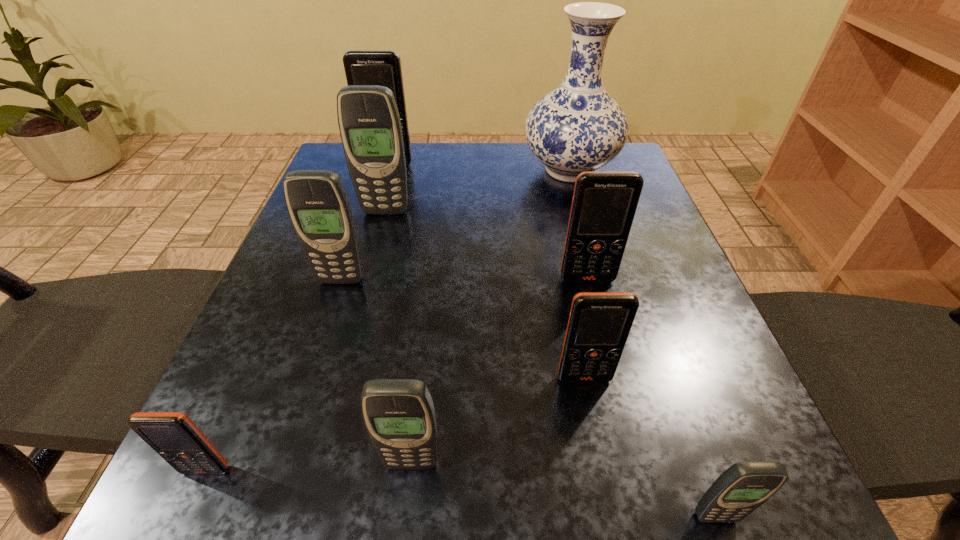
You are a GUI agent. You are given a task and a screenshot of the screen. Output one action in this format:
    pyautogui.click(x=<x>, y=<y>)
    Task: Click on the blank space located 0.350m on the screen of the third nearest gray cellular telephone
    
    Given the screenshot: What is the action you would take?
    pyautogui.click(x=276, y=482)

Locate an element on the screen. This screenshot has width=960, height=540. vacant space located 0.050m on the screen of the fourth nearest cellular telephone is located at coordinates (592, 415).

Image resolution: width=960 pixels, height=540 pixels. I want to click on vase situated at the far edge, so click(x=578, y=127).

The width and height of the screenshot is (960, 540). I want to click on cellular telephone at the far edge, so click(x=362, y=67).

This screenshot has width=960, height=540. Find the location of `vase at the right edge`. vase at the right edge is located at coordinates (578, 127).

Identify the location of object at the far left corner. The image size is (960, 540). (362, 67).

Find the location of a particular element. object that is at the near left corner is located at coordinates (173, 435).

Identify the location of object that is at the far right corner. (578, 127).

Identify the location of object that is positioned at the near right corner. (742, 488).

Find the location of `vacant region at the far edge of the desktop`. vacant region at the far edge of the desktop is located at coordinates (413, 184).